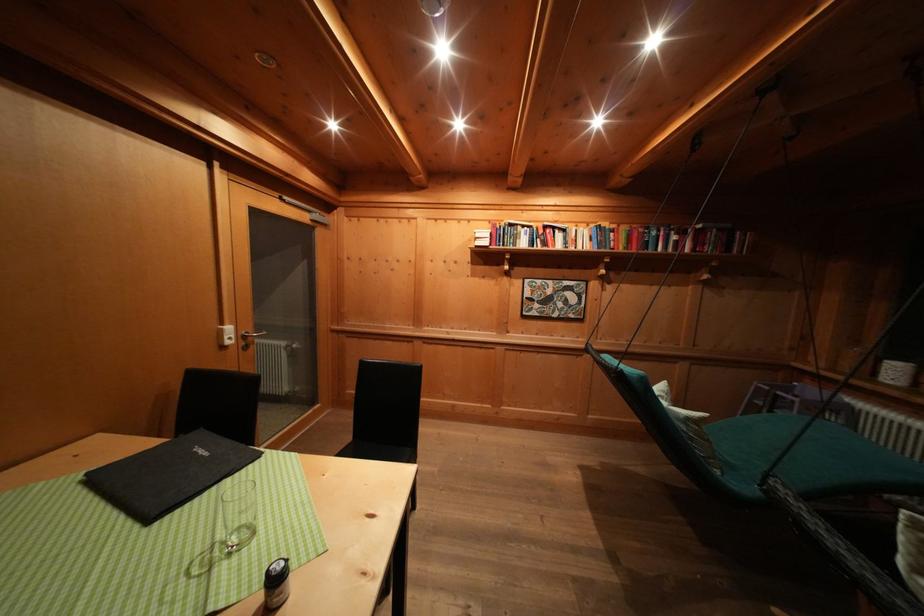
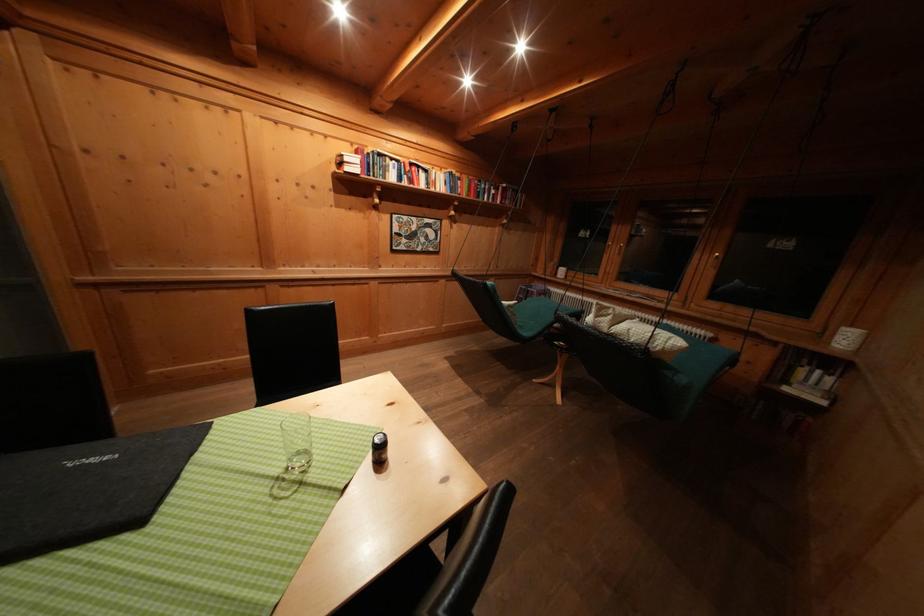
In the second image, find the point that corresponds to [552,232] in the first image.

(418, 169)